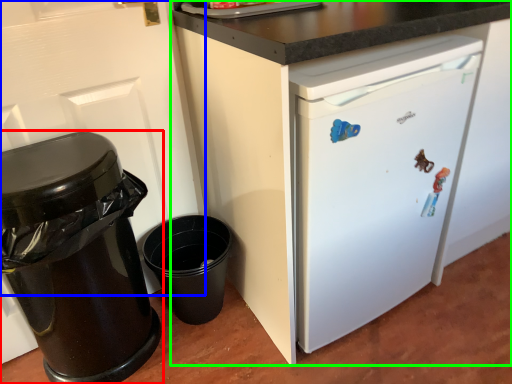
Question: Considering the real-world distances, which object is closest to waste container (highlighted by a red box)? door (highlighted by a blue box) or cabinetry (highlighted by a green box).

Choices:
 (A) door
 (B) cabinetry

Answer: (A)